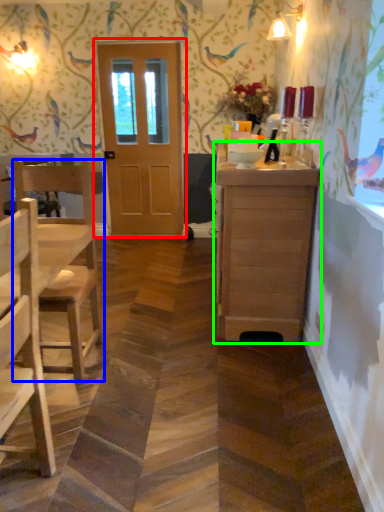
Question: Considering the real-world distances, which object is farthest from door (highlighted by a red box)? chair (highlighted by a blue box) or cabinetry (highlighted by a green box)?

Choices:
 (A) chair
 (B) cabinetry

Answer: (B)